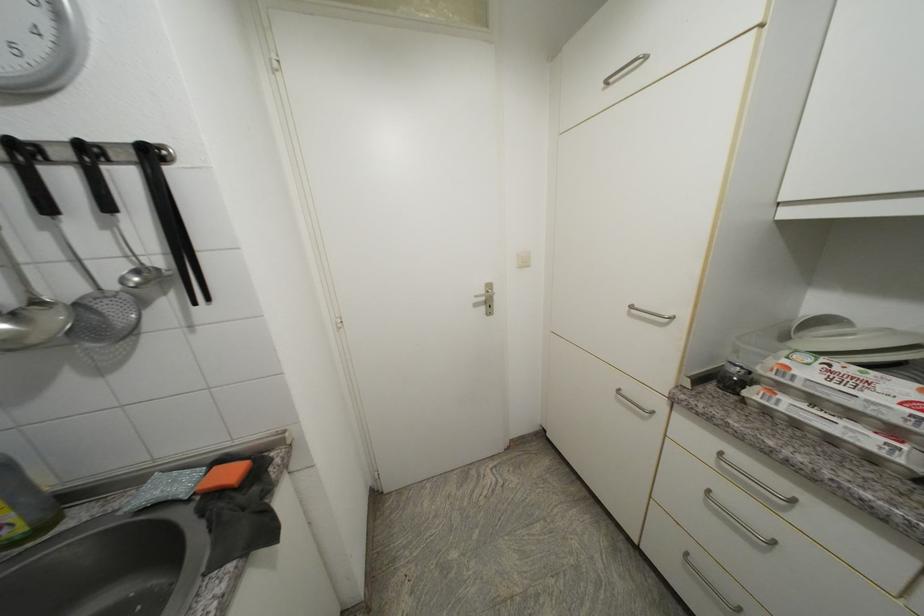
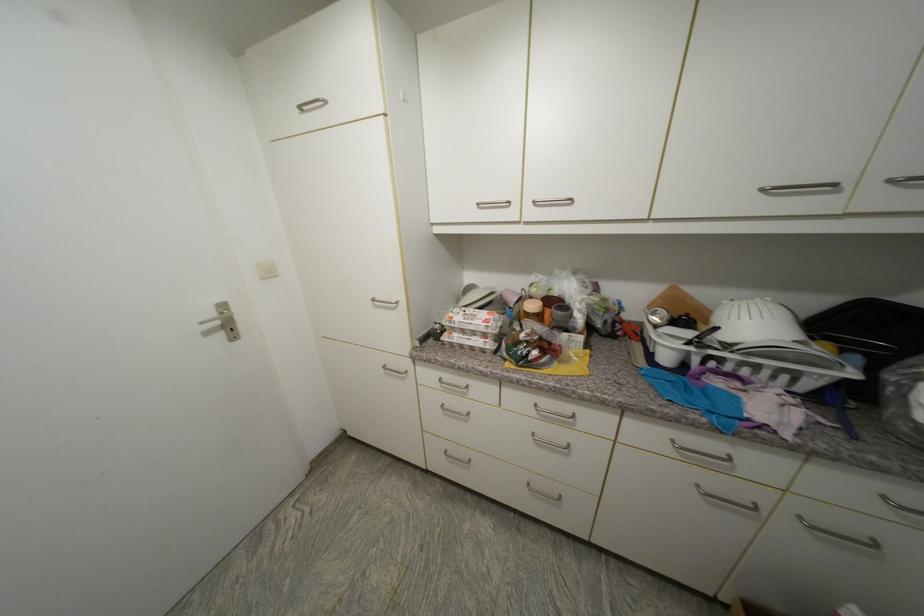
Find the pixel in the second image that matches pixel 625 392 in the first image.

(390, 369)